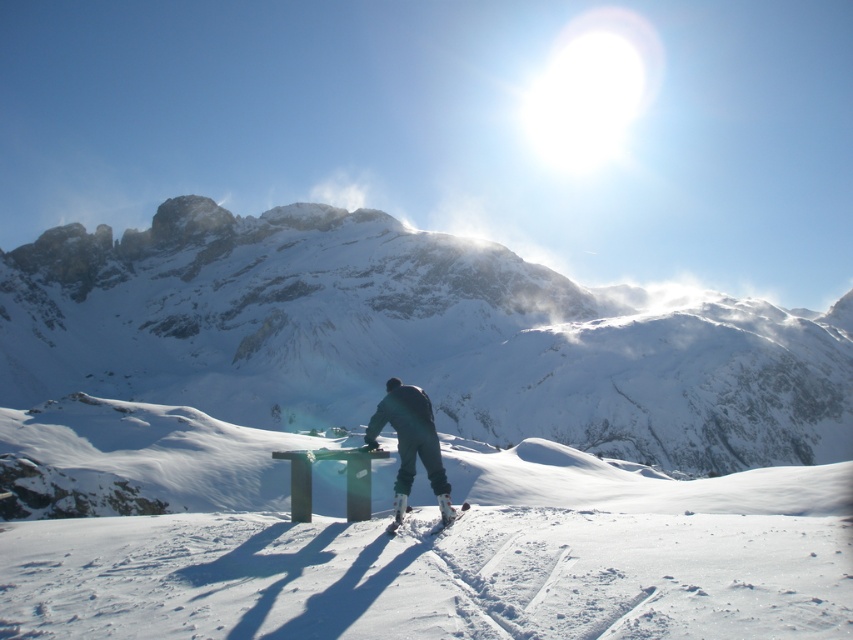
Question: Can you confirm if snowy rock mountain at center is positioned to the left of white matte snowboard at lower center?

Choices:
 (A) yes
 (B) no

Answer: (B)

Question: Which is nearer to the white matte snowboard at lower center?

Choices:
 (A) dark blue snow pants at center
 (B) snowy rock mountain at center

Answer: (A)

Question: Among these objects, which one is nearest to the camera?

Choices:
 (A) dark blue snow pants at center
 (B) snowy rock mountain at center

Answer: (A)

Question: Among these objects, which one is nearest to the camera?

Choices:
 (A) white matte snowboard at lower center
 (B) snowy rock mountain at center
 (C) dark blue snow pants at center

Answer: (A)

Question: Where is snowy rock mountain at center located in relation to white matte snowboard at lower center in the image?

Choices:
 (A) left
 (B) right

Answer: (B)

Question: In this image, where is dark blue snow pants at center located relative to white matte snowboard at lower center?

Choices:
 (A) below
 (B) above

Answer: (B)